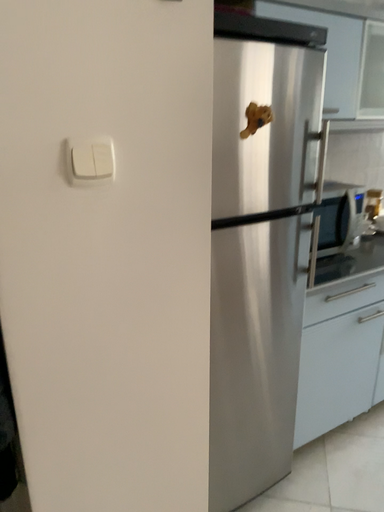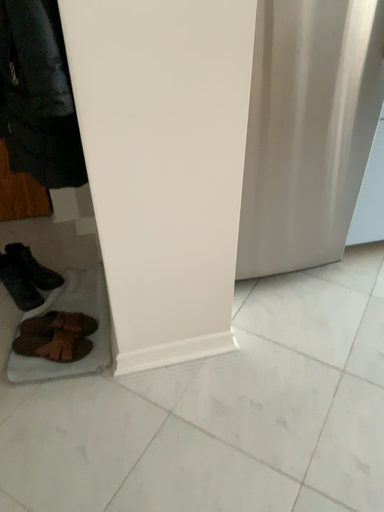
Question: How did the camera likely rotate when shooting the video?

Choices:
 (A) rotated right
 (B) rotated left

Answer: (B)